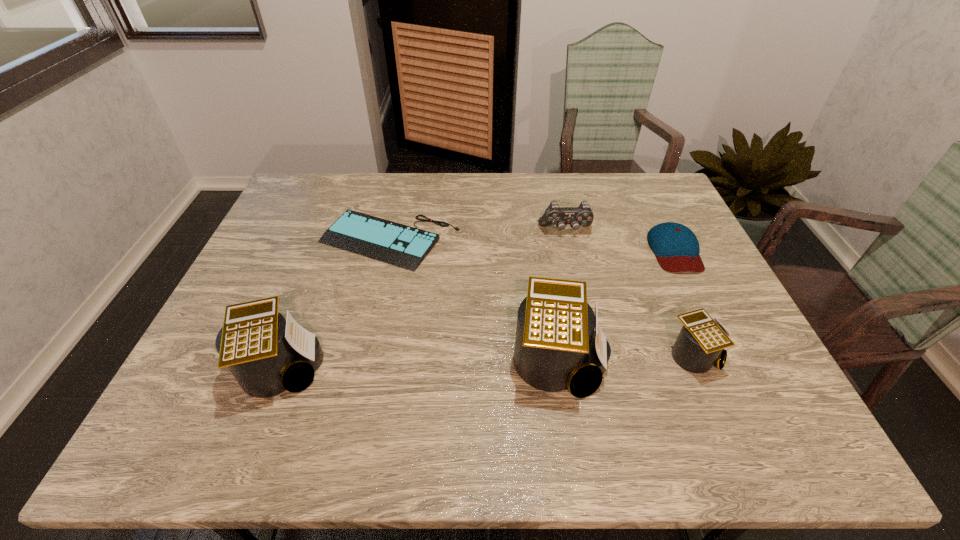
This screenshot has height=540, width=960. In order to click on vacant area that lies between the second tallest calculator and the control in this screenshot , I will do `click(423, 300)`.

Locate an element on the screen. object that is the fifth closest to the rightmost calculator is located at coordinates coord(267,355).

Locate which object is the third closest to the leftmost calculator. Please provide its 2D coordinates. Your answer should be formatted as a tuple, i.e. [(x, y)], where the tuple contains the x and y coordinates of a point satisfying the conditions above.

[(583, 215)]

Locate which calculator ranks in proximity to the second calculator from right to left. Please provide its 2D coordinates. Your answer should be formatted as a tuple, i.e. [(x, y)], where the tuple contains the x and y coordinates of a point satisfying the conditions above.

[(701, 341)]

Select which calculator is the closest to the control. Please provide its 2D coordinates. Your answer should be formatted as a tuple, i.e. [(x, y)], where the tuple contains the x and y coordinates of a point satisfying the conditions above.

[(556, 347)]

Where is `vacant position in the image that satisfies the following two spatial constraints: 1. on the back side of the shortest calculator; 2. on the left side of the second calculator from right to left`? The height and width of the screenshot is (540, 960). vacant position in the image that satisfies the following two spatial constraints: 1. on the back side of the shortest calculator; 2. on the left side of the second calculator from right to left is located at coordinates (x=559, y=356).

Locate an element on the screen. This screenshot has width=960, height=540. vacant space that satisfies the following two spatial constraints: 1. on the back side of the leftmost calculator; 2. on the right side of the shortest calculator is located at coordinates (285, 356).